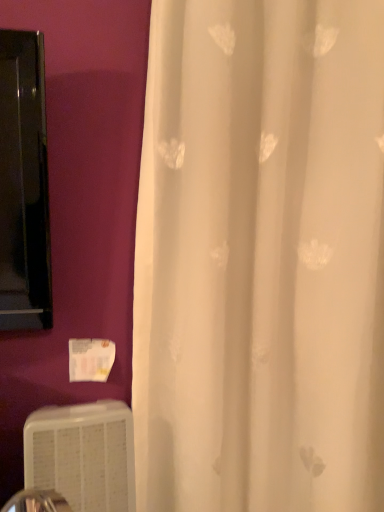
Describe the element at coordinates (83, 455) in the screenshot. I see `white plastic air conditioning unit at lower left` at that location.

The image size is (384, 512). I want to click on white plastic air conditioning unit at lower left, so click(x=83, y=455).

Find the location of `white plastic air conditioning unit at lower left`. white plastic air conditioning unit at lower left is located at coordinates (83, 455).